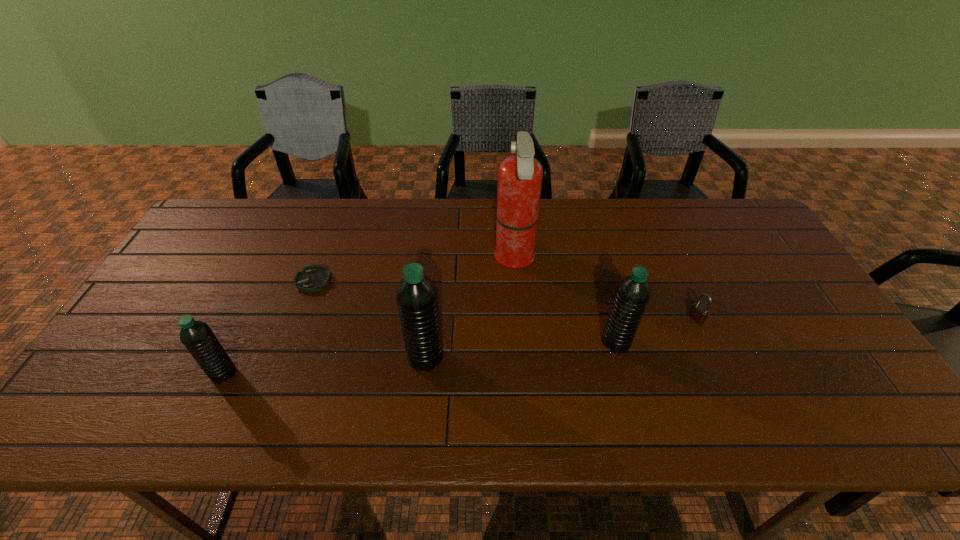
I want to click on object present at the far edge, so click(x=520, y=176).

Locate an element on the screen. The image size is (960, 540). vacant area at the far edge is located at coordinates (424, 222).

Image resolution: width=960 pixels, height=540 pixels. Find the location of `vacant space at the near edge of the desktop`. vacant space at the near edge of the desktop is located at coordinates (248, 367).

You are a GUI agent. You are given a task and a screenshot of the screen. Output one action in this format:
    pyautogui.click(x=<x>, y=<y>)
    Task: Click on the vacant area at the left edge
    The height and width of the screenshot is (540, 960).
    Given the screenshot: What is the action you would take?
    pyautogui.click(x=230, y=253)

Where is `vacant space at the far left corner`? The width and height of the screenshot is (960, 540). vacant space at the far left corner is located at coordinates (246, 230).

Locate an element on the screen. Image resolution: width=960 pixels, height=540 pixels. vacant space at the far right corner of the desktop is located at coordinates (736, 244).

Where is `free space between the second object from left to right and the rightmost water bottle`? The width and height of the screenshot is (960, 540). free space between the second object from left to right and the rightmost water bottle is located at coordinates (465, 312).

The height and width of the screenshot is (540, 960). I want to click on free spot between the rightmost object and the fire extinguisher, so click(x=606, y=288).

The width and height of the screenshot is (960, 540). What are the coordinates of `vacant point located between the ashtray and the third object from left to right` in the screenshot? It's located at (370, 319).

This screenshot has width=960, height=540. Find the location of `empty space between the second shortest object and the second shortest water bottle`. empty space between the second shortest object and the second shortest water bottle is located at coordinates (657, 330).